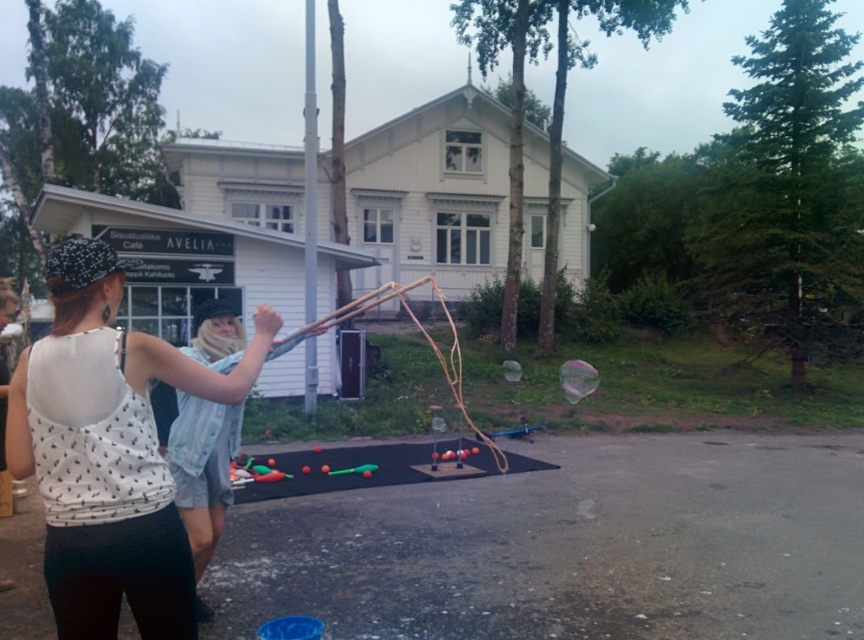
Question: Is white matte tank top at center further to camera compared to denim shorts at center?

Choices:
 (A) no
 (B) yes

Answer: (A)

Question: Can you confirm if white matte tank top at center is positioned below denim shorts at center?

Choices:
 (A) yes
 (B) no

Answer: (B)

Question: Is white matte tank top at center bigger than denim shorts at center?

Choices:
 (A) no
 (B) yes

Answer: (B)

Question: Which of the following is the closest to the observer?

Choices:
 (A) (27, 388)
 (B) (192, 356)

Answer: (A)

Question: Among these points, which one is farthest from the camera?

Choices:
 (A) (83, 259)
 (B) (182, 474)

Answer: (B)